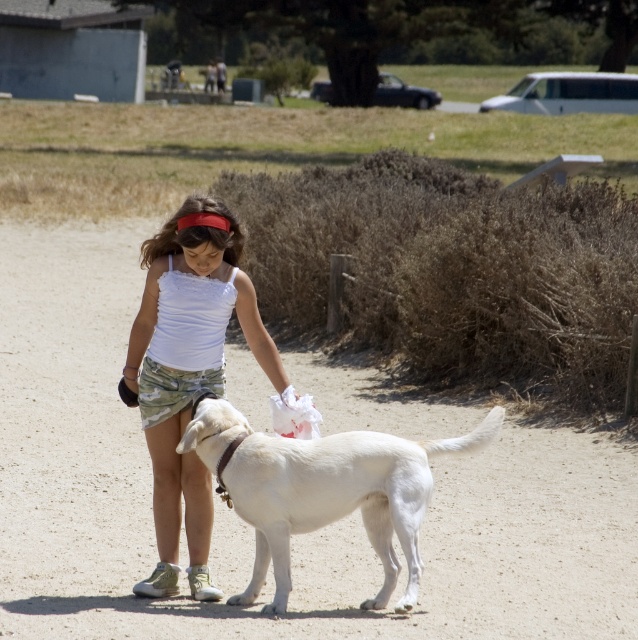
You are a photographer trying to capture the dirt track at center and the white cotton tank top at center in a single shot. Considering their heights, which object will appear larger in the photo?

The dirt track at center is much taller than the white cotton tank top at center, so it will appear larger in the photo.

You are a photographer standing at the edge of the dirt track at center. You want to capture a photo that includes both the dirt track and the trees in the background. Considering the distance of the dirt track from the camera, will the trees be in focus if you focus on the dirt track?

The dirt track at center is 25.77 feet away from the camera. Since the trees are further away than the dirt track, they will likely be in focus if you focus on the dirt track, as depth of field typically extends further behind the point of focus than in front.